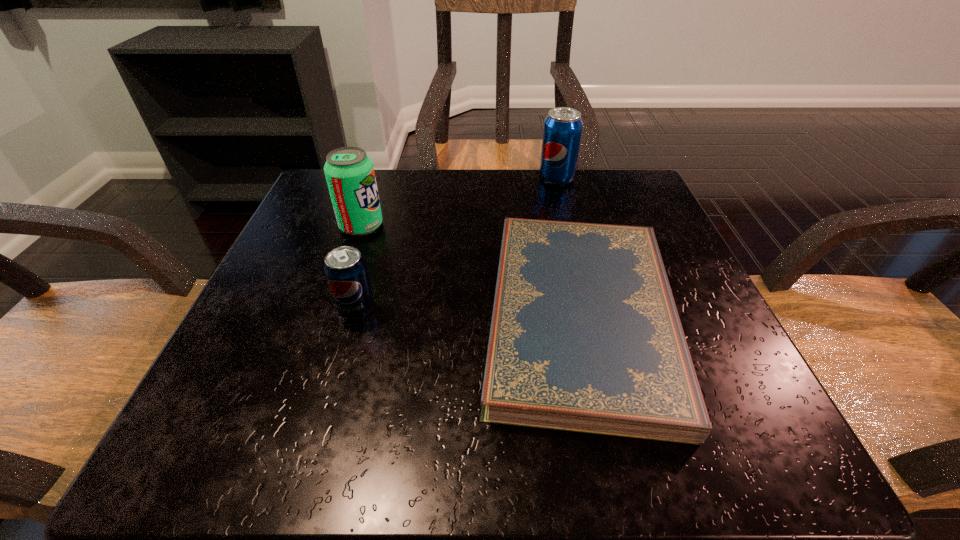
This screenshot has height=540, width=960. What are the coordinates of `the rightmost soda can` in the screenshot? It's located at (562, 130).

The image size is (960, 540). In order to click on the farthest soda can in this screenshot , I will do `click(562, 130)`.

I want to click on the second farthest soda can, so click(x=349, y=172).

The height and width of the screenshot is (540, 960). I want to click on the nearest soda can, so click(x=345, y=269).

This screenshot has width=960, height=540. In order to click on the third tallest object in this screenshot , I will do `click(345, 269)`.

The width and height of the screenshot is (960, 540). Identify the location of the shortest object. (585, 336).

Find the location of `vacant position located 0.200m on the front of the farthest object`. vacant position located 0.200m on the front of the farthest object is located at coordinates (573, 242).

At what (x,y) coordinates should I click in order to perform the action: click on free space located on the front-facing side of the second nearest soda can. Please return your answer as a coordinate pair (x, y). The height and width of the screenshot is (540, 960). Looking at the image, I should click on (570, 226).

The image size is (960, 540). In order to click on vacant position located 0.370m on the right of the shortest soda can in this screenshot , I will do `click(607, 309)`.

This screenshot has width=960, height=540. Find the location of `free point located 0.320m on the left of the paperback book`. free point located 0.320m on the left of the paperback book is located at coordinates (276, 316).